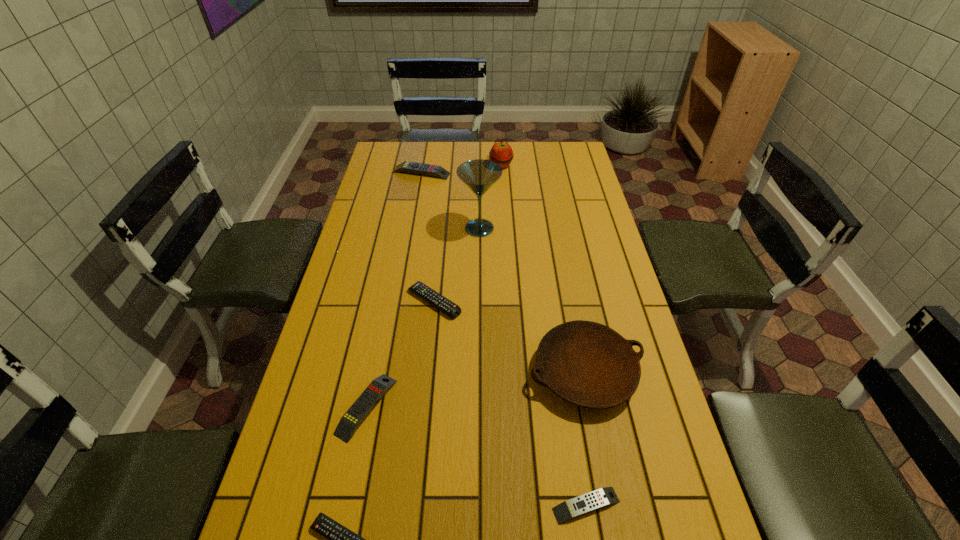
You are a GUI agent. You are given a task and a screenshot of the screen. Output one action in this format:
    pyautogui.click(x=<x>, y=<y>)
    Task: Click on the free space between the second tallest remote control and the third tallest object
    The width and height of the screenshot is (960, 540).
    Given the screenshot: What is the action you would take?
    pyautogui.click(x=476, y=389)

Image resolution: width=960 pixels, height=540 pixels. Find the location of `free area in between the bigger black remote control and the fifth tallest object`. free area in between the bigger black remote control and the fifth tallest object is located at coordinates (400, 354).

Find the location of `free space between the nearest yellow remote control and the second nearest yellow remote control`. free space between the nearest yellow remote control and the second nearest yellow remote control is located at coordinates (476, 456).

This screenshot has width=960, height=540. I want to click on empty location between the smallest yellow remote control and the tallest object, so click(x=533, y=367).

Locate an element on the screen. Image resolution: width=960 pixels, height=540 pixels. vacant space in between the second smallest yellow remote control and the sixth nearest object is located at coordinates (423, 318).

Image resolution: width=960 pixels, height=540 pixels. I want to click on free space between the smallest yellow remote control and the martini, so click(x=533, y=367).

You are a GUI agent. You are given a task and a screenshot of the screen. Output one action in this format:
    pyautogui.click(x=<x>, y=<y>)
    Task: Click on the free space between the apple and the plate
    
    Given the screenshot: What is the action you would take?
    pyautogui.click(x=542, y=269)

Identify which object is the seventh nearest to the bigger black remote control. Please provide its 2D coordinates. Your answer should be formatted as a tuple, i.e. [(x, y)], where the tuple contains the x and y coordinates of a point satisfying the conditions above.

[(501, 153)]

Locate which object is the third closest to the bigger black remote control. Please provide its 2D coordinates. Your answer should be formatted as a tuple, i.e. [(x, y)], where the tuple contains the x and y coordinates of a point satisfying the conditions above.

[(479, 175)]

This screenshot has width=960, height=540. I want to click on remote control that stands as the closest to the second biggest yellow remote control, so click(340, 539).